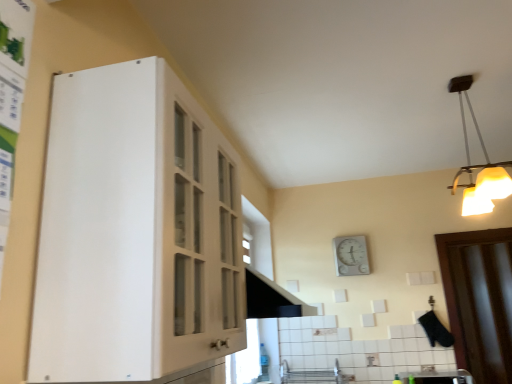
The image size is (512, 384). Identify the location of empty space that is ontop of brown wooden door at right (from a real-world perspective). (477, 230).